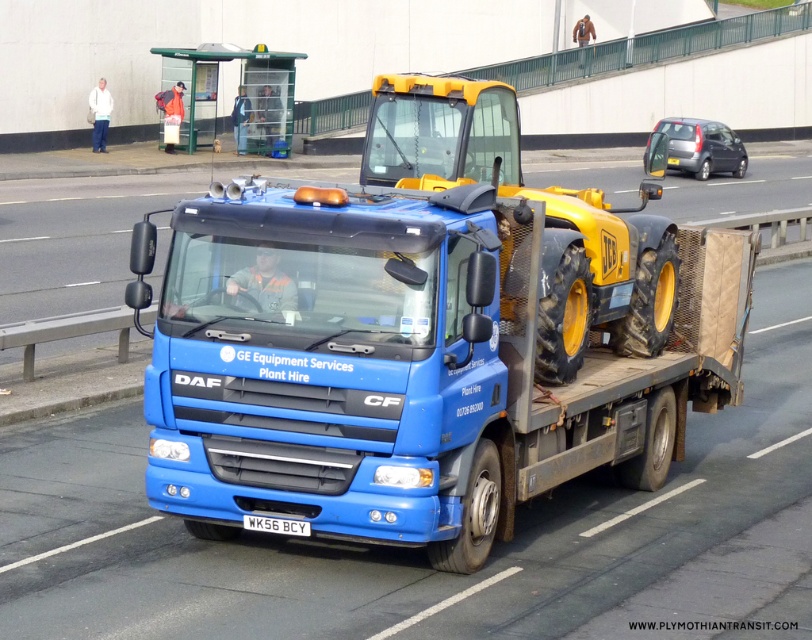
Who is taller, blue matte truck at center or white plastic license plate at center?

blue matte truck at center

Can you confirm if blue matte truck at center is thinner than white plastic license plate at center?

No.

Is point (206, 257) behind point (253, 525)?

Yes, it is behind point (253, 525).

Image resolution: width=812 pixels, height=640 pixels. Identify the location of blue matte truck at center. (417, 362).